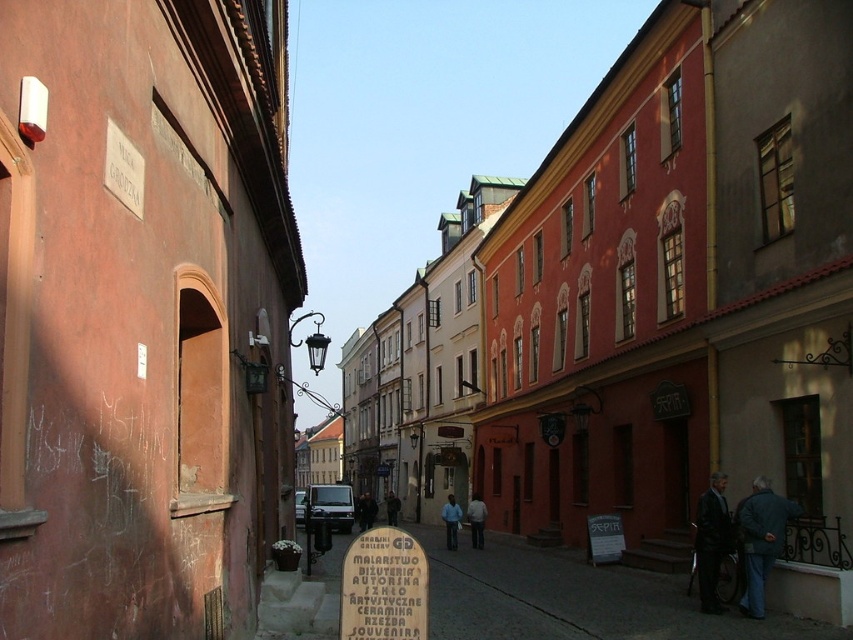
You are a tailor observing two jackets in a historic European town scene. The jackets are the blue denim jacket at lower right and the dark gray jacket at center. Which jacket has a smaller thickness?

The blue denim jacket at lower right is thinner than the dark gray jacket at center, so the blue denim jacket at lower right has a smaller thickness.

You are a tourist standing in the middle of the street. You notice a wooden signboard at center and a light blue fabric jacket at center. Which object is taller when viewed from your position?

The light blue fabric jacket at center is taller than the wooden signboard at center.